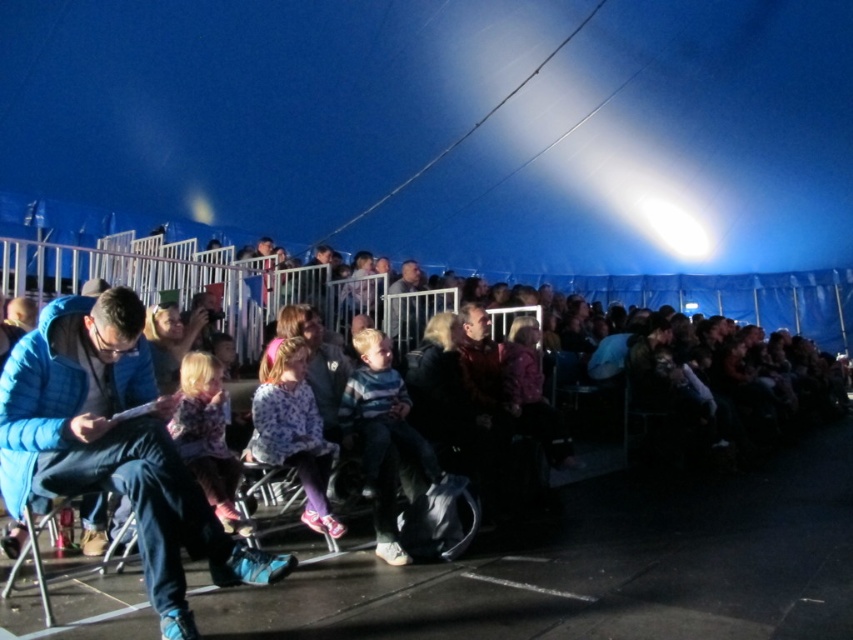
In the scene shown: You are a photographer at the event and want to capture both the floral sweater at center and the fluffy pink dress at center in a single photo. Given that your camera has a maximum focus range of 10 inches, will you be able to focus on both subjects simultaneously?

The distance between the floral sweater at center and the fluffy pink dress at center is 10.66 inches, which exceeds the camera maximum focus range of 10 inches. Therefore, you cannot focus on both subjects simultaneously.

You are a photographer at the event and want to capture a photo that includes both the blue quilted jacket at left and the fluffy pink dress at center. Since you want to ensure both are fully visible, which object should you focus on first to avoid cropping either?

The blue quilted jacket at left is taller than the fluffy pink dress at center. To ensure both are fully visible in the photo, focus on the blue quilted jacket at left first, as its greater height requires more space in the frame.

You are an event organizer who needs to arrange a photo shoot. You have two participants wearing a matte blue jacket at center and a floral sweater at center. Which participant should you choose if you need someone with a wider garment for a full body shot?

The matte blue jacket at center has a greater width than the floral sweater at center, so you should choose the participant wearing the matte blue jacket at center for the full body shot.